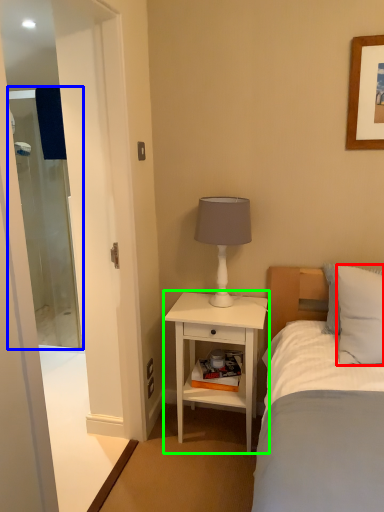
Question: Which object is positioned closest to pillow (highlighted by a red box)? Select from screen door (highlighted by a blue box) and nightstand (highlighted by a green box).

Choices:
 (A) screen door
 (B) nightstand

Answer: (B)